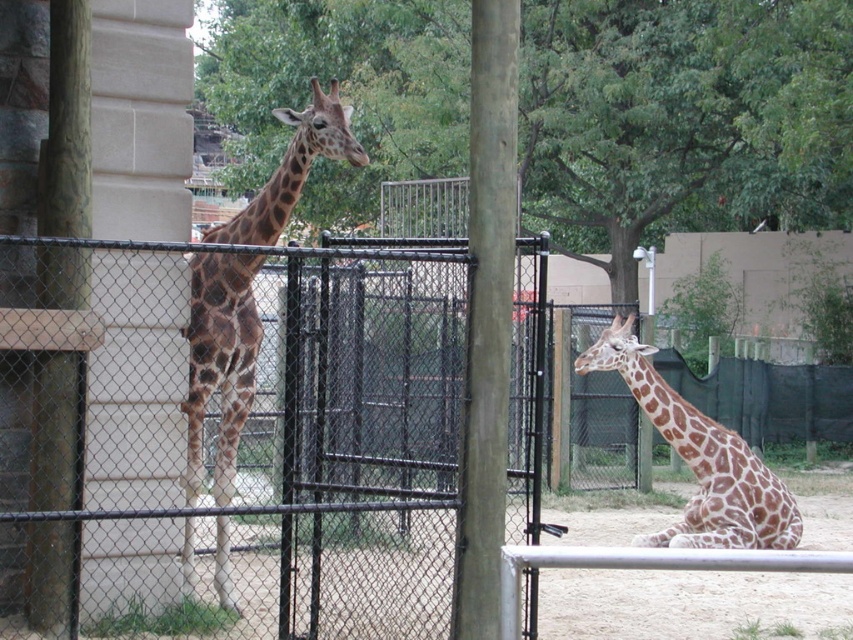
Question: Is smooth wood pole at center to the right of spotted brown giraffe at left from the viewer's perspective?

Choices:
 (A) no
 (B) yes

Answer: (B)

Question: Is the position of white concrete pillar at left less distant than that of smooth wood pole at center?

Choices:
 (A) yes
 (B) no

Answer: (B)

Question: Which object is closer to the camera taking this photo?

Choices:
 (A) spotted brown giraffe at left
 (B) black chain-link fence at center
 (C) white concrete pillar at left
 (D) brown spotted giraffe at lower right

Answer: (C)

Question: Which point appears farthest from the camera in this image?

Choices:
 (A) (126, 362)
 (B) (405, 304)

Answer: (A)

Question: Among these objects, which one is farthest from the camera?

Choices:
 (A) green leafy tree at upper center
 (B) white concrete pillar at left

Answer: (A)

Question: Does green leafy tree at upper center have a smaller size compared to spotted brown giraffe at left?

Choices:
 (A) yes
 (B) no

Answer: (B)